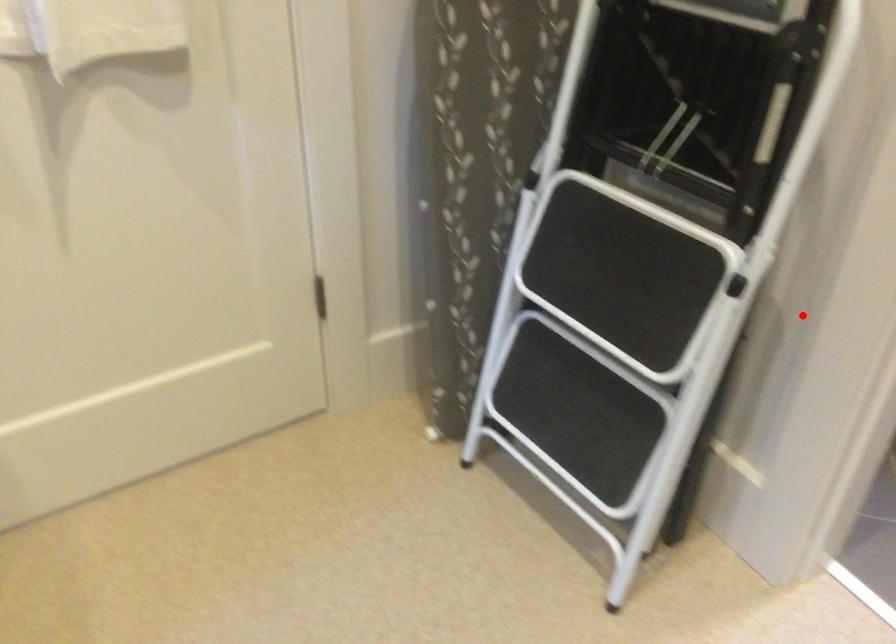
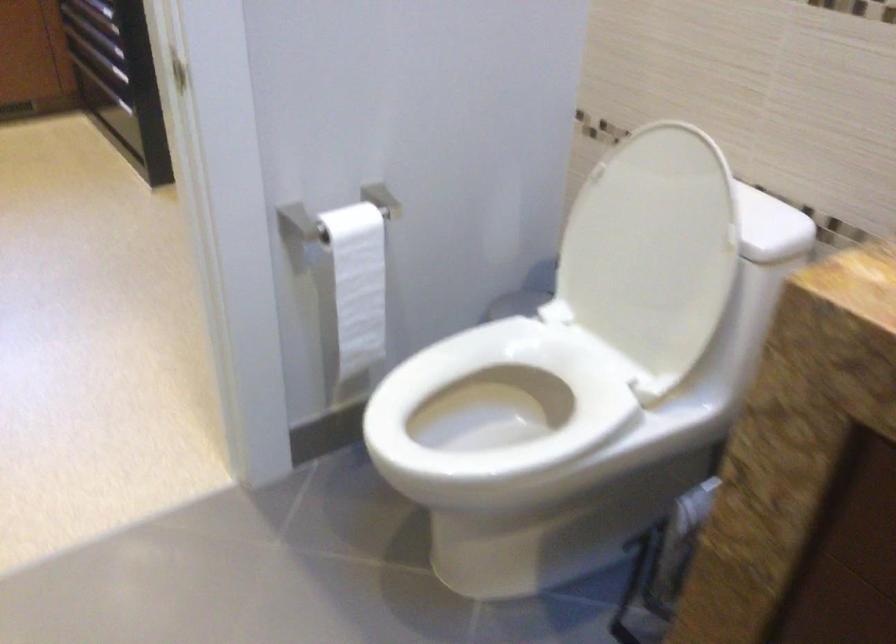
Question: I am providing you with two images of the same scene from different viewpoints. Image1 has a red point marked. In image2, the corresponding 3D location appears at what relative position? Reply with the corresponding letter.

Choices:
 (A) Closer
 (B) Farther

Answer: (B)